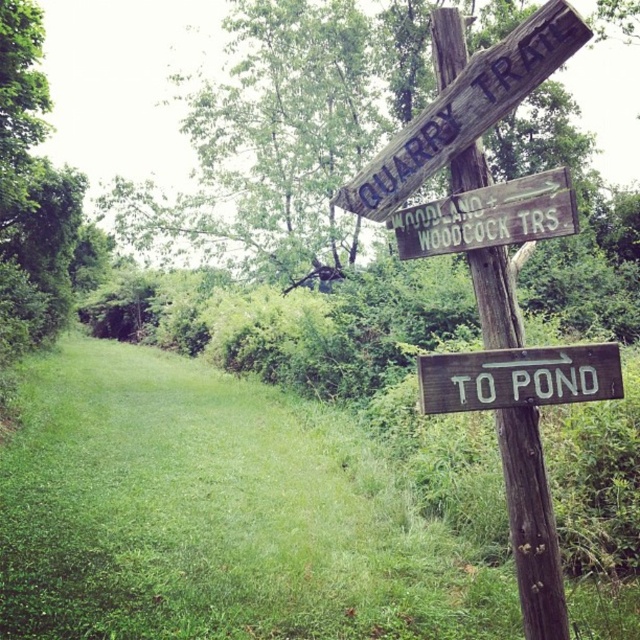
You are a hiker trying to read the directions on the wooden sign at lower right and the wooden signpost at upper center. Which of these two has a greater width?

The wooden sign at lower right has a greater width than the wooden signpost at upper center.

Based on the photo, you are standing on the grassy path and want to read both the wooden signpost at right and the weathered wood sign at upper center. Which sign will you need to look at first to avoid having to turn your head?

The wooden signpost at right is closer to you than the weathered wood sign at upper center, so you should look at the wooden signpost at right first before the weathered wood sign at upper center.